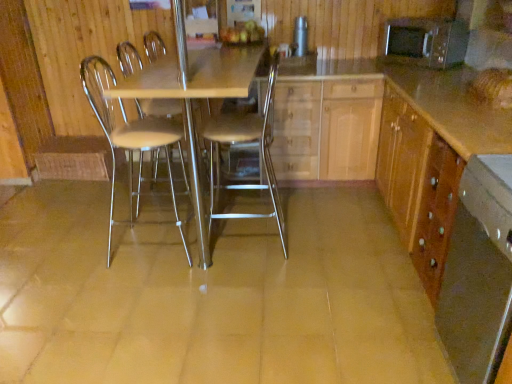
Question: Is wooden cabinet at right, the second cabinetry viewed from the left, to the left or to the right of metallic silver chair at center, the second chair when ordered from left to right, in the image?

Choices:
 (A) left
 (B) right

Answer: (B)

Question: Considering the positions of wooden cabinet at right, the second cabinetry viewed from the left, and metallic silver chair at center, the second chair when ordered from left to right, in the image, is wooden cabinet at right, the second cabinetry viewed from the left, taller or shorter than metallic silver chair at center, the second chair when ordered from left to right,?

Choices:
 (A) tall
 (B) short

Answer: (B)

Question: Based on their relative distances, which object is farther from the metallic cylindrical container at upper center, the 1th appliance in the left-to-right sequence?

Choices:
 (A) metallic microwave at upper right, acting as the 2th appliance starting from the left
 (B) wooden cabinet at right, which is the 1th cabinetry from right to left
 (C) metallic/transparent table at center
 (D) wooden drawer at lower right
 (E) light wood/texture cabinet at center, acting as the 2th cabinetry starting from the right

Answer: (D)

Question: Which of these objects is positioned farthest from the wooden drawer at lower right?

Choices:
 (A) metallic cylindrical container at upper center, the second appliance in the right-to-left sequence
 (B) metallic microwave at upper right, the 1th appliance positioned from the right
 (C) metallic silver chair at center, the 2th chair when ordered from right to left
 (D) light wood/texture cabinet at center, placed as the first cabinetry when sorted from left to right
 (E) metallic/transparent table at center

Answer: (A)